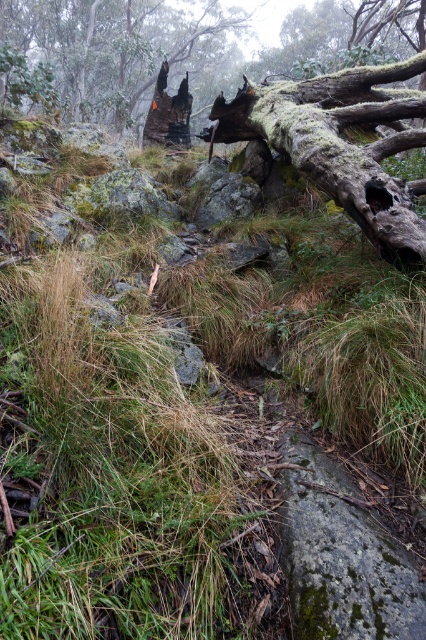
You are a hiker trying to cross a narrow path between two trees. The path is between the mossy bark tree trunk at upper center and the charcoal burnt tree stump at upper center. Can you pass through if you are 1.2 meters wide?

The mossy bark tree trunk at upper center is narrower than the charcoal burnt tree stump at upper center. Since the path is between them, the width available would depend on the distance between the trunks. However, the description only states the width of the trunks, not the distance between them. Therefore, it is unclear if the path is wide enough for a 1.2 meter wide hiker.